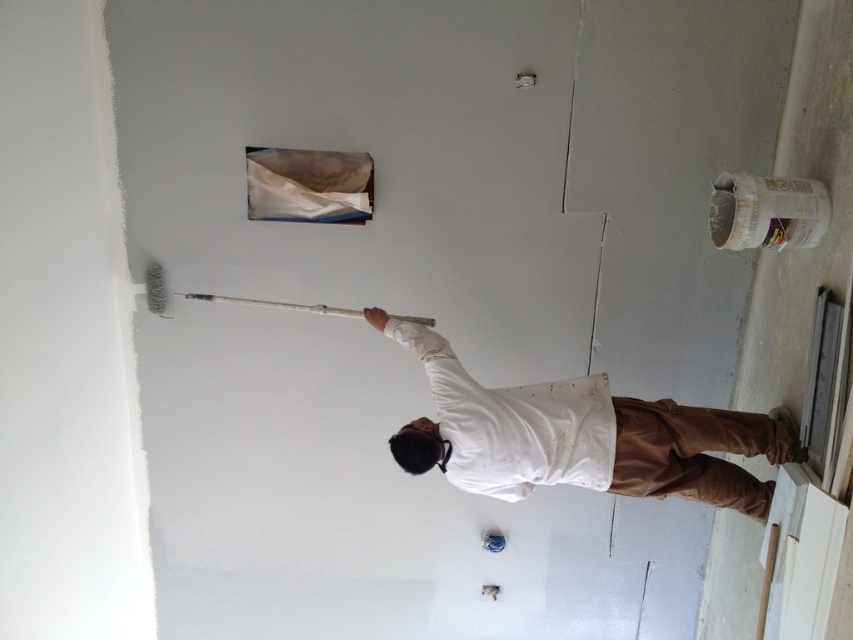
Consider the image. You are standing in the room where the person is painting the wall. There are two points marked on the wall at coordinates point (x=664, y=461) and point (x=395, y=314). Which point is closer to you?

Point (x=664, y=461) is in front of point (x=395, y=314), so it is closer to you.

You are helping someone paint a wall and notice the white paper at upper center and the white synthetic paint roller at upper center. Which object is wider?

The white synthetic paint roller at upper center is wider than the white paper at upper center.

You are standing in front of the wall being painted and notice two points marked on the wall. The first point is at coordinates point (341, 211) and the second is at point (393, 317). Which point is closer to you?

Point (341, 211) is further to the camera than point (393, 317), so the point closer to you is point (393, 317).